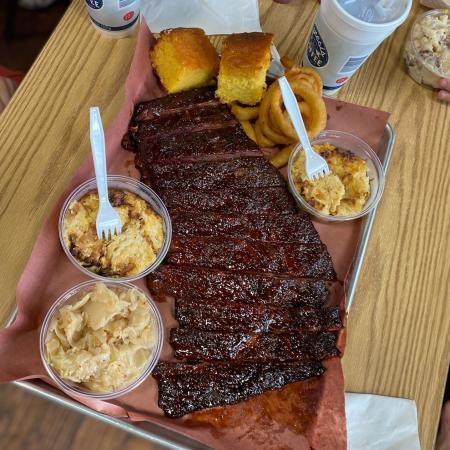
I want to click on clear bowl, so click(435, 83).